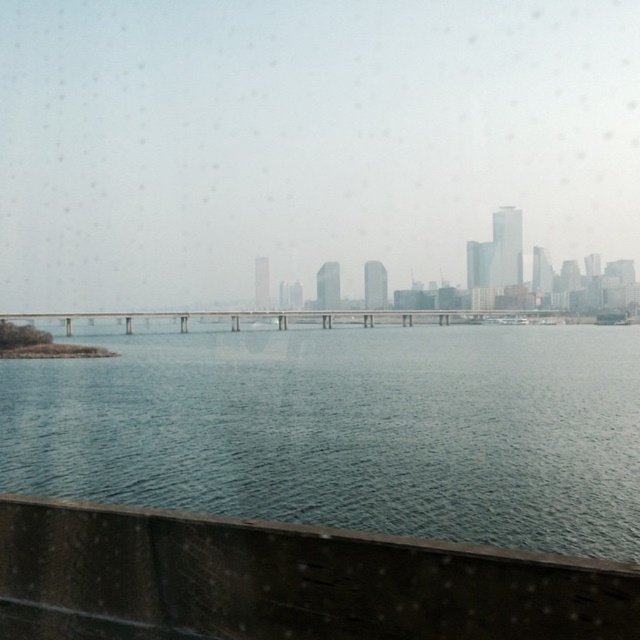
You are standing on the concrete bridge at center and looking towards the blue water at center. Which direction should you walk to reach the water?

You should walk downward towards the blue water at center since it is located below the concrete bridge at center.

You are a delivery drone with a wingspan of 1.5 meters. You need to fly from the blue water at center to the concrete bridge at center. Is there enough space between them for your drone to pass safely?

The blue water at center and concrete bridge at center are 26.93 meters apart from each other, so yes, the drone can pass safely between them since the distance is much larger than the drone wingspan of 1.5 meters.